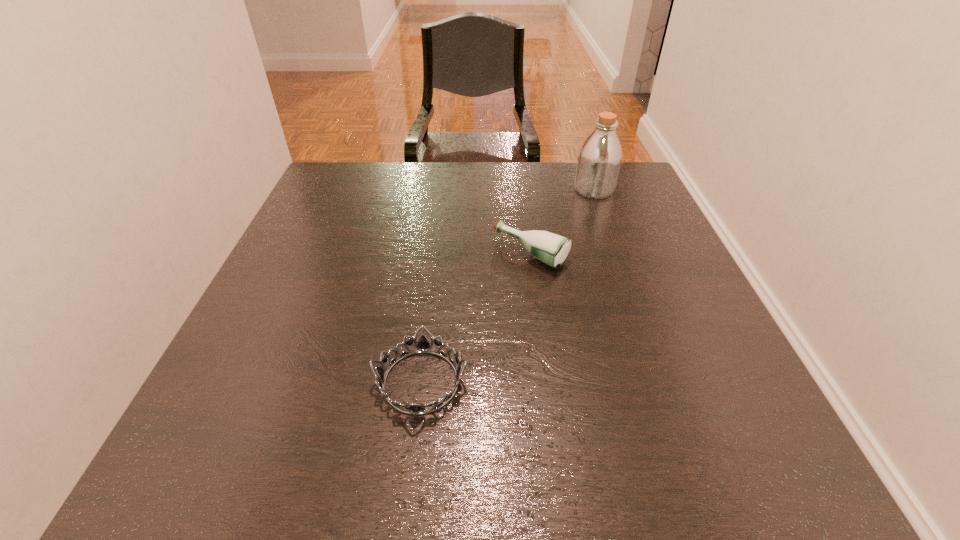
Find the location of a particular element. The height and width of the screenshot is (540, 960). free space that is in between the tiara and the shorter bottle is located at coordinates (476, 318).

Identify the location of blank region between the farthest object and the tiara. (507, 286).

This screenshot has height=540, width=960. In order to click on free space that is in between the left bottle and the tiara in this screenshot , I will do `click(476, 318)`.

This screenshot has height=540, width=960. Identify the location of free space between the right bottle and the tiara. (507, 286).

Locate an element on the screen. vacant area between the rightmost object and the shorter bottle is located at coordinates (563, 222).

Image resolution: width=960 pixels, height=540 pixels. I want to click on free point between the farther bottle and the leftmost object, so click(x=507, y=286).

Point out which object is positioned as the nearest to the shortest object. Please provide its 2D coordinates. Your answer should be formatted as a tuple, i.e. [(x, y)], where the tuple contains the x and y coordinates of a point satisfying the conditions above.

[(552, 249)]

Identify which object is the second nearest to the shortest object. Please provide its 2D coordinates. Your answer should be formatted as a tuple, i.e. [(x, y)], where the tuple contains the x and y coordinates of a point satisfying the conditions above.

[(599, 159)]

You are a GUI agent. You are given a task and a screenshot of the screen. Output one action in this format:
    pyautogui.click(x=<x>, y=<y>)
    Task: Click on the free space that satisfies the following two spatial constraints: 1. on the back side of the rightmost object; 2. on the right side of the nearer bottle
    The width and height of the screenshot is (960, 540).
    Given the screenshot: What is the action you would take?
    (522, 190)